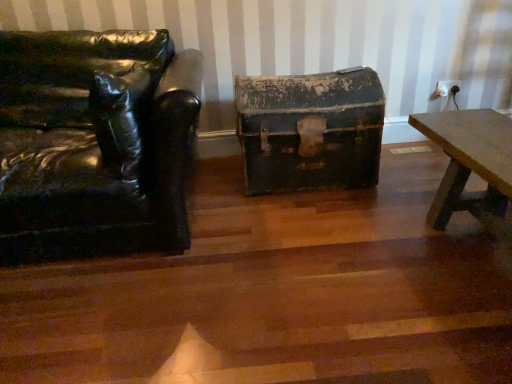
Question: From a real-world perspective, is rusty metal chest at center positioned above or below black leather chair at left?

Choices:
 (A) above
 (B) below

Answer: (B)

Question: Choose the correct answer: Is rusty metal chest at center inside black leather chair at left or outside it?

Choices:
 (A) outside
 (B) inside

Answer: (A)

Question: From the image's perspective, is rusty metal chest at center located above or below black leather chair at left?

Choices:
 (A) above
 (B) below

Answer: (A)

Question: Visually, is black leather chair at left positioned to the left or to the right of rusty metal chest at center?

Choices:
 (A) left
 (B) right

Answer: (A)

Question: In terms of height, does black leather chair at left look taller or shorter compared to rusty metal chest at center?

Choices:
 (A) tall
 (B) short

Answer: (A)

Question: Is point (40, 49) positioned closer to the camera than point (364, 94)?

Choices:
 (A) farther
 (B) closer

Answer: (B)

Question: Considering their positions, is black leather chair at left located in front of or behind rusty metal chest at center?

Choices:
 (A) front
 (B) behind

Answer: (A)